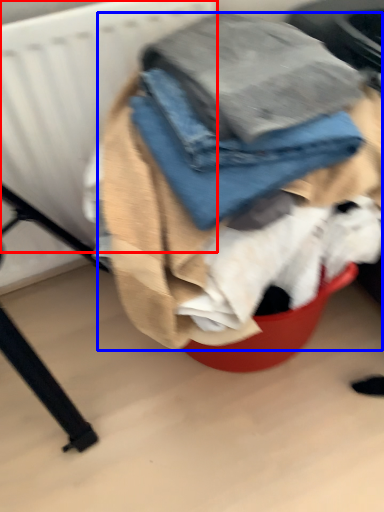
Question: Among these objects, which one is nearest to the camera, radiator (highlighted by a red box) or laundry (highlighted by a blue box)?

Choices:
 (A) radiator
 (B) laundry

Answer: (B)